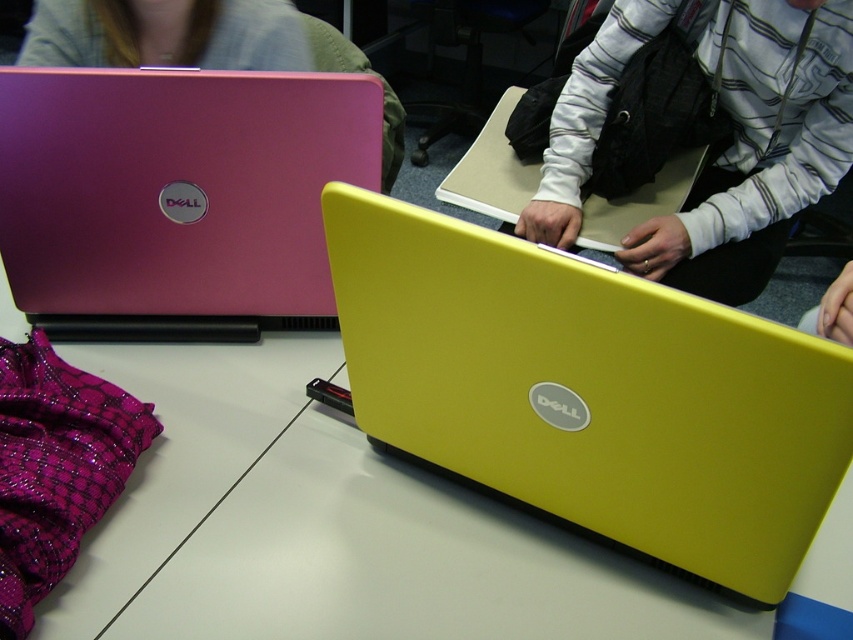
Question: Which object is positioned farthest from the yellow matte laptop at center?

Choices:
 (A) matte pink laptop at upper left
 (B) matte pink laptop at left
 (C) white striped hoodie at center

Answer: (C)

Question: Can you confirm if matte pink laptop at left is smaller than matte pink laptop at upper left?

Choices:
 (A) yes
 (B) no

Answer: (A)

Question: Which point is closer to the camera taking this photo?

Choices:
 (A) (134, 48)
 (B) (722, 499)

Answer: (B)

Question: Is matte pink laptop at left positioned behind white striped hoodie at center?

Choices:
 (A) yes
 (B) no

Answer: (B)

Question: Which object is positioned closest to the yellow matte laptop at center?

Choices:
 (A) white striped hoodie at center
 (B) matte pink laptop at left

Answer: (B)

Question: Does yellow matte laptop at center have a larger size compared to matte pink laptop at left?

Choices:
 (A) yes
 (B) no

Answer: (A)